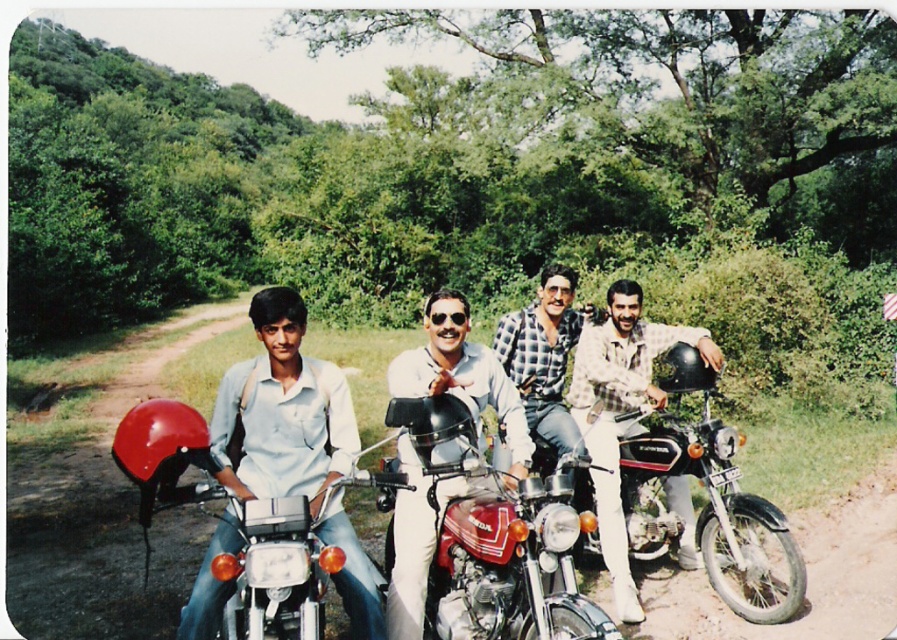
Question: Which point is closer to the camera?

Choices:
 (A) shiny chrome motorcycle at center
 (B) shiny silver helmet at center

Answer: (A)

Question: Does shiny red motorcycle at center have a lesser width compared to shiny chrome motorcycle at center?

Choices:
 (A) yes
 (B) no

Answer: (A)

Question: Which object is the farthest from the shiny red motorcycle at center?

Choices:
 (A) shiny chrome motorcycle at center
 (B) shiny silver helmet at center
 (C) plaid shirt at center

Answer: (C)

Question: Considering the real-world distances, which object is closest to the shiny red motorcycle at center?

Choices:
 (A) plaid shirt at center
 (B) checkered fabric shirt at center

Answer: (A)

Question: Considering the relative positions of shiny red motorcycle at center and plaid shirt at center in the image provided, where is shiny red motorcycle at center located with respect to plaid shirt at center?

Choices:
 (A) below
 (B) above

Answer: (A)

Question: Is shiny red motorcycle at center wider than plaid shirt at center?

Choices:
 (A) yes
 (B) no

Answer: (A)